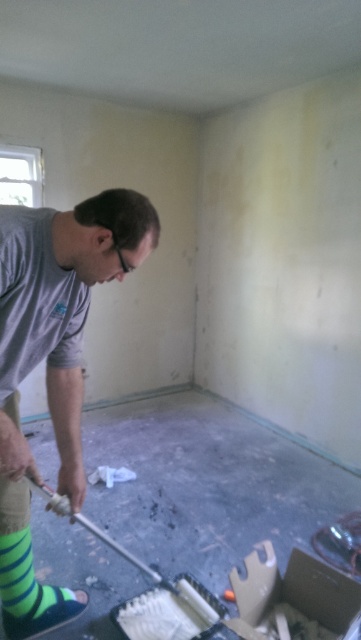
You are organizing a charity clothing drive and need to pack items into boxes. You have a box that can only fit items wider than 30 cm. You see the gray cotton shirt at center and the green striped sock at lower left. Which item should you place in the box if you know that one of them is wider than 30 cm?

The gray cotton shirt at center is wider than the green striped sock at lower left. Therefore, if the gray cotton shirt at center is wider than 30 cm, it should be placed in the box. However, if the green striped sock at lower left is the one wider than 30 cm, it should be placed in the box instead. Since the description only states the shirt is wider than the sock, but not their exact widths, we cannot definitively determine which one meets the 30 cm requirement without additional information.

You are standing in the room and want to pick up the gray cotton shirt at center and the green striped sock at lower left. Which item will you need to bend down more to reach?

The green striped sock at lower left requires bending down more because it is positioned lower and farther from the viewer compared to the gray cotton shirt at center, which is closer.

You are standing in the room and want to place a small plant between the gray cotton shirt at center and the green striped sock at lower left. Which object should the plant be closer to based on their heights?

The gray cotton shirt at center is taller than the green striped sock at lower left, so the plant should be placed closer to the gray cotton shirt at center to balance the height difference.